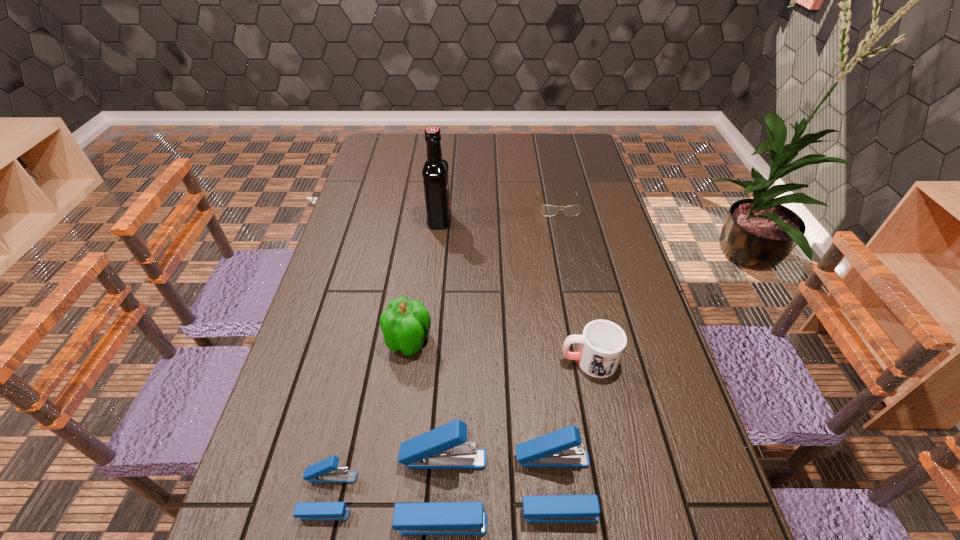
Image resolution: width=960 pixels, height=540 pixels. Find the location of `the leftmost object`. the leftmost object is located at coordinates (325, 471).

You are a GUI agent. You are given a task and a screenshot of the screen. Output one action in this format:
    pyautogui.click(x=<x>, y=<y>)
    Task: Click on the shortest stapler
    This screenshot has width=960, height=540.
    Given the screenshot: What is the action you would take?
    pyautogui.click(x=325, y=471)

Find the location of `the second stapler from left to right`. the second stapler from left to right is located at coordinates (445, 447).

Find the location of a particular element. The width and height of the screenshot is (960, 540). the rightmost stapler is located at coordinates (562, 448).

Where is `the second shortest stapler`? The image size is (960, 540). the second shortest stapler is located at coordinates (562, 448).

Where is `the tallest object`? The width and height of the screenshot is (960, 540). the tallest object is located at coordinates (435, 169).

The height and width of the screenshot is (540, 960). I want to click on spectacles, so click(x=546, y=210).

Identify the location of bell pepper. This screenshot has height=540, width=960. (405, 324).

Identify the location of the third shortest object. (602, 343).

At what (x,y) coordinates should I click in order to perform the action: click on free point located on the right of the shortest stapler. Please return your answer as a coordinate pair (x, y). This screenshot has width=960, height=540. Looking at the image, I should click on (435, 495).